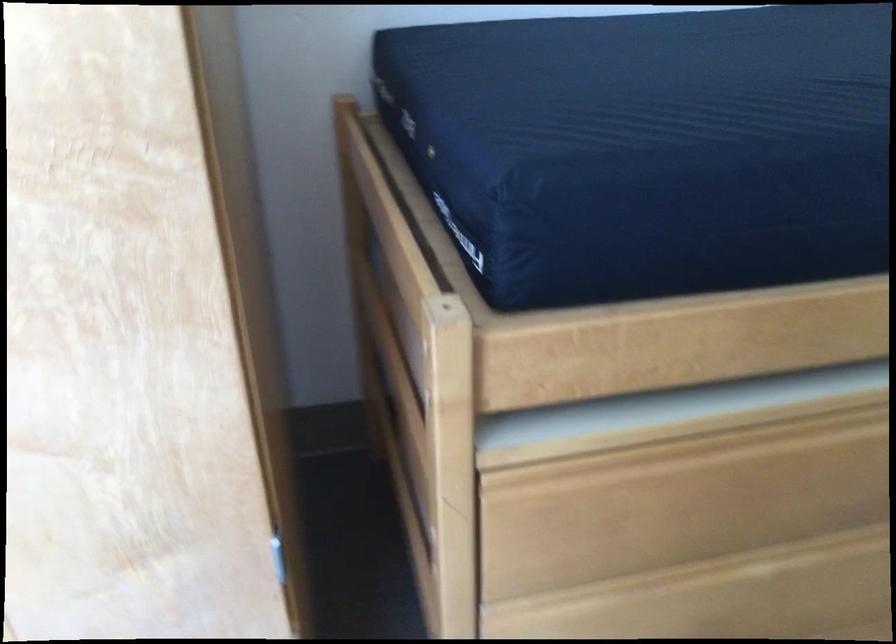
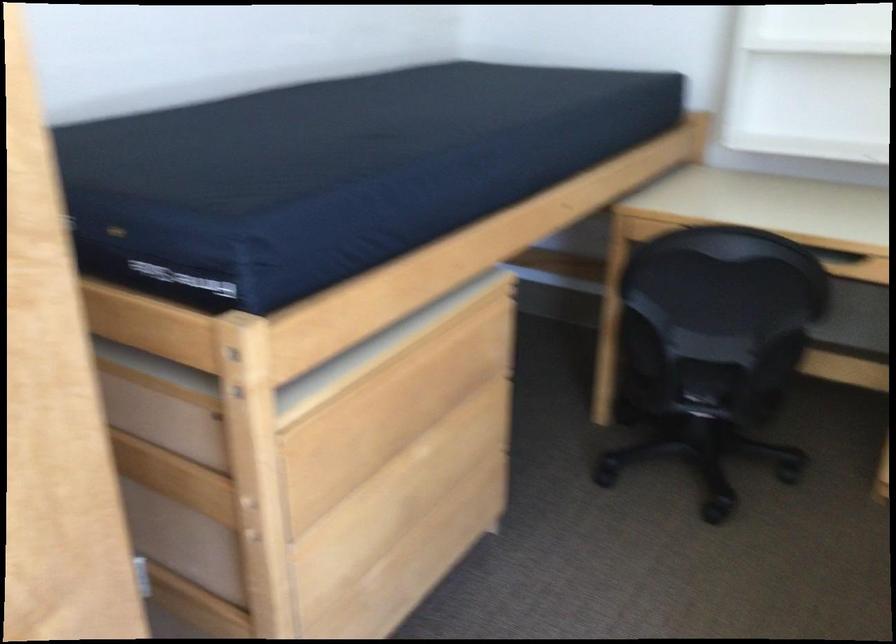
Where in the second image is the point corresponding to point 733,453 from the first image?

(403, 379)